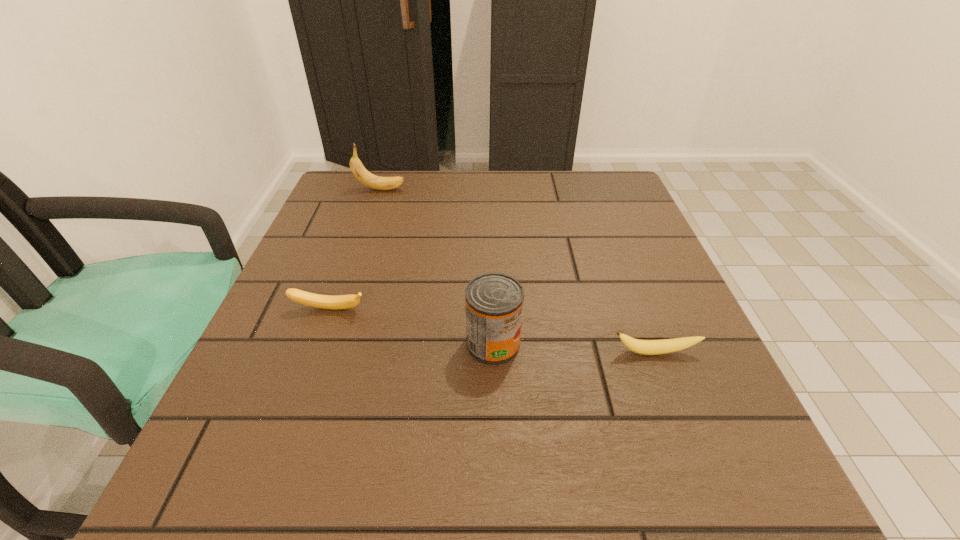
In order to click on object located in the far edge section of the desktop in this screenshot , I will do `click(360, 172)`.

The image size is (960, 540). What are the coordinates of `object that is at the right edge` in the screenshot? It's located at (645, 347).

This screenshot has height=540, width=960. I want to click on object that is at the far left corner, so click(x=360, y=172).

I want to click on free region at the far edge of the desktop, so click(405, 184).

Find the location of a particular element. Image resolution: width=960 pixels, height=540 pixels. vacant space at the near edge of the desktop is located at coordinates 428,497.

Image resolution: width=960 pixels, height=540 pixels. Identify the location of vacant space at the left edge. (243, 382).

The height and width of the screenshot is (540, 960). In the image, there is a desktop. What are the coordinates of `vacant space at the right edge` in the screenshot? It's located at (649, 303).

Where is `vacant area at the far left corner`? Image resolution: width=960 pixels, height=540 pixels. vacant area at the far left corner is located at coordinates (387, 193).

In the image, there is a desktop. Where is `vacant space at the near left corner`? The width and height of the screenshot is (960, 540). vacant space at the near left corner is located at coordinates (198, 464).

You are a GUI agent. You are given a task and a screenshot of the screen. Output one action in this format:
    pyautogui.click(x=<x>, y=<y>)
    Task: Click on the vacant space at the far right corner of the desktop
    Image resolution: width=960 pixels, height=540 pixels.
    Given the screenshot: What is the action you would take?
    pyautogui.click(x=618, y=213)